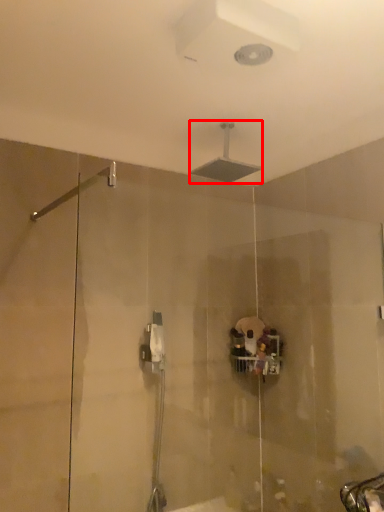
Question: Considering the relative positions of shower (annotated by the red box) and shower in the image provided, where is shower (annotated by the red box) located with respect to the staircase?

Choices:
 (A) right
 (B) left

Answer: (A)